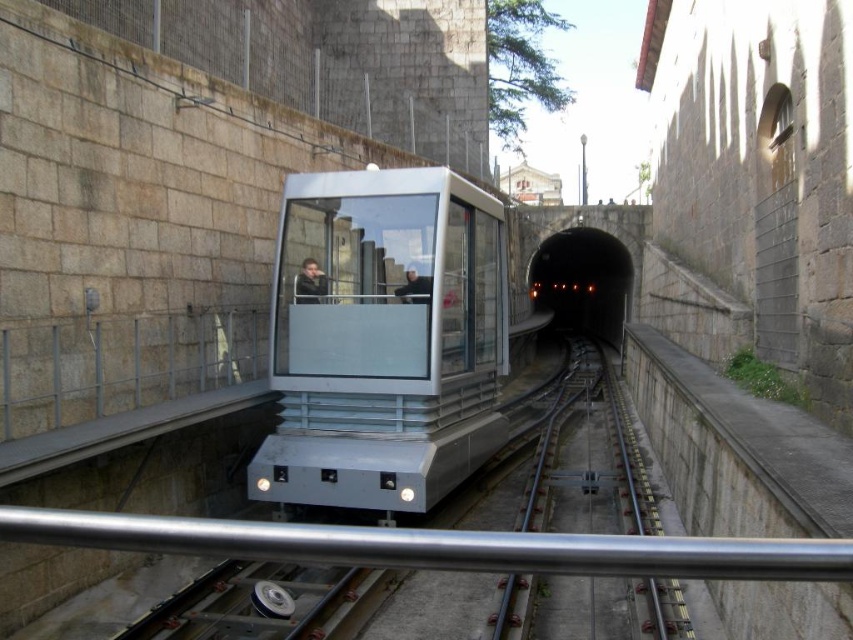
Question: Can you confirm if metallic silver tram at center is positioned below metal/smooth train track at center?

Choices:
 (A) no
 (B) yes

Answer: (A)

Question: Does metallic silver tram at center come in front of metal/smooth train track at center?

Choices:
 (A) yes
 (B) no

Answer: (B)

Question: Which point is farther to the camera?

Choices:
 (A) (318, 332)
 (B) (611, 275)

Answer: (B)

Question: Does metallic silver tram at center have a lesser width compared to metal/smooth train track at center?

Choices:
 (A) no
 (B) yes

Answer: (B)

Question: Among these objects, which one is nearest to the camera?

Choices:
 (A) metal/smooth train track at center
 (B) metallic silver tram at center
 (C) black concrete tunnel at center

Answer: (A)

Question: Considering the real-world distances, which object is closest to the metallic silver tram at center?

Choices:
 (A) metal/smooth train track at center
 (B) black concrete tunnel at center

Answer: (A)